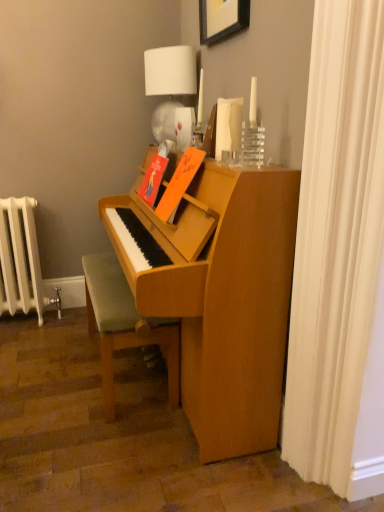
Question: Is wooden picture frame at upper center not near white fabric shower curtain at right?

Choices:
 (A) yes
 (B) no

Answer: (A)

Question: Is wooden picture frame at upper center closer to camera compared to white fabric shower curtain at right?

Choices:
 (A) no
 (B) yes

Answer: (A)

Question: Considering the relative sizes of wooden picture frame at upper center and white fabric shower curtain at right in the image provided, is wooden picture frame at upper center thinner than white fabric shower curtain at right?

Choices:
 (A) no
 (B) yes

Answer: (A)

Question: Is wooden picture frame at upper center oriented towards white fabric shower curtain at right?

Choices:
 (A) yes
 (B) no

Answer: (B)

Question: From the image's perspective, is wooden picture frame at upper center over white fabric shower curtain at right?

Choices:
 (A) no
 (B) yes

Answer: (B)

Question: In terms of size, does white painted metal radiator at left appear bigger or smaller than white fabric lampshade at upper center?

Choices:
 (A) big
 (B) small

Answer: (A)

Question: Is white painted metal radiator at left wider or thinner than white fabric lampshade at upper center?

Choices:
 (A) wide
 (B) thin

Answer: (A)

Question: Considering the positions of point (0, 199) and point (190, 116), is point (0, 199) closer or farther from the camera than point (190, 116)?

Choices:
 (A) farther
 (B) closer

Answer: (A)

Question: In terms of height, does white painted metal radiator at left look taller or shorter compared to white fabric lampshade at upper center?

Choices:
 (A) short
 (B) tall

Answer: (B)

Question: Considering the positions of point (160, 332) and point (238, 10), is point (160, 332) closer or farther from the camera than point (238, 10)?

Choices:
 (A) closer
 (B) farther

Answer: (B)

Question: From the image's perspective, relative to wooden picture frame at upper center, is light brown wooden bench at lower center above or below?

Choices:
 (A) above
 (B) below

Answer: (B)

Question: In the image, is light brown wooden bench at lower center positioned in front of or behind wooden picture frame at upper center?

Choices:
 (A) behind
 (B) front

Answer: (A)

Question: Is light brown wooden bench at lower center to the left or to the right of wooden picture frame at upper center in the image?

Choices:
 (A) right
 (B) left

Answer: (B)

Question: From the image's perspective, is white fabric lampshade at upper center positioned above or below white fabric shower curtain at right?

Choices:
 (A) above
 (B) below

Answer: (A)

Question: In the image, is white fabric lampshade at upper center positioned in front of or behind white fabric shower curtain at right?

Choices:
 (A) front
 (B) behind

Answer: (B)